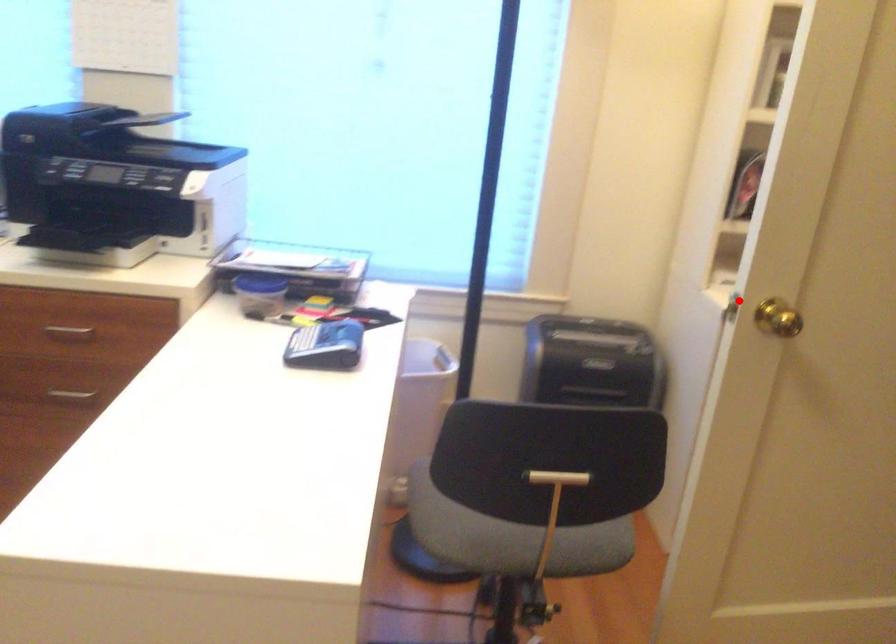
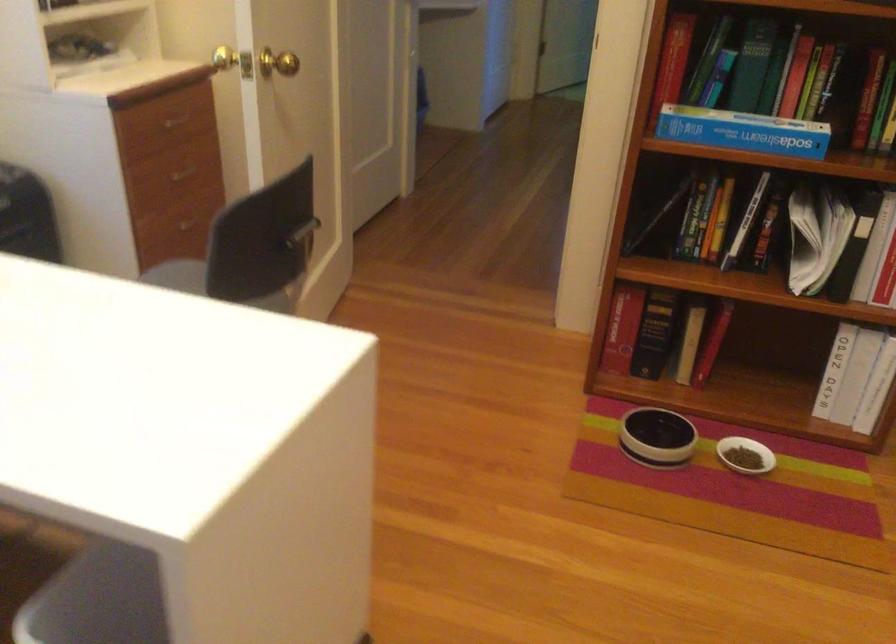
Locate, in the second image, the point that corresponds to the highlighted location in the first image.

(233, 61)